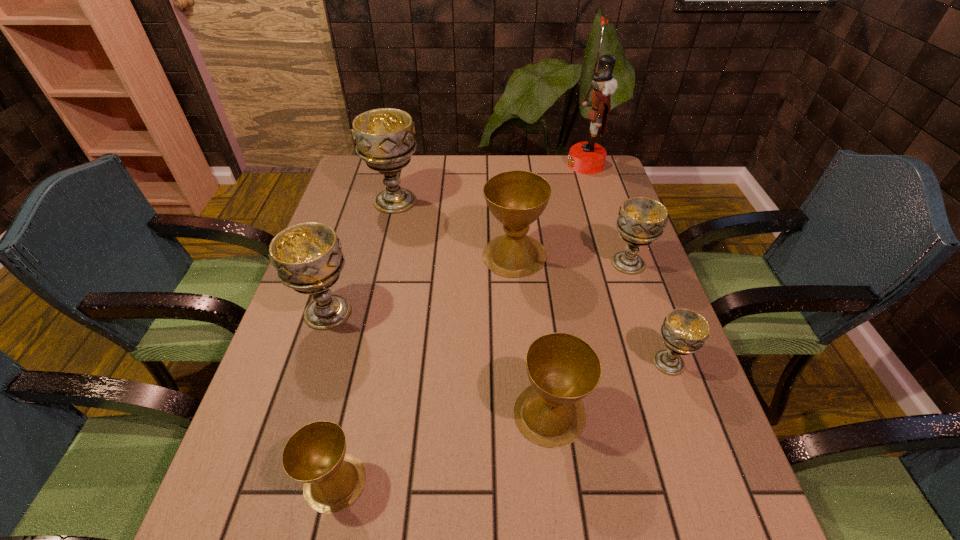
At what (x,y) coordinates should I click in order to perform the action: click on brown chalice that can be found as the closest to the second smallest white chalice. Please return your answer as a coordinate pair (x, y). This screenshot has height=540, width=960. Looking at the image, I should click on (516, 198).

Identify the location of blank space that satisfies the following two spatial constraints: 1. on the front-facing side of the nutcracker; 2. on the back side of the sixth farthest object. This screenshot has width=960, height=540. (649, 362).

At what (x,y) coordinates should I click in order to perform the action: click on free location that satisfies the following two spatial constraints: 1. on the front-facing side of the tallest object; 2. on the right side of the fifth farthest chalice. Please return your answer as a coordinate pair (x, y). The height and width of the screenshot is (540, 960). Looking at the image, I should click on (649, 362).

This screenshot has width=960, height=540. Identify the location of vacant area in the image that satisfies the following two spatial constraints: 1. on the front-facing side of the red nutcracker; 2. on the back side of the third nearest object. (649, 362).